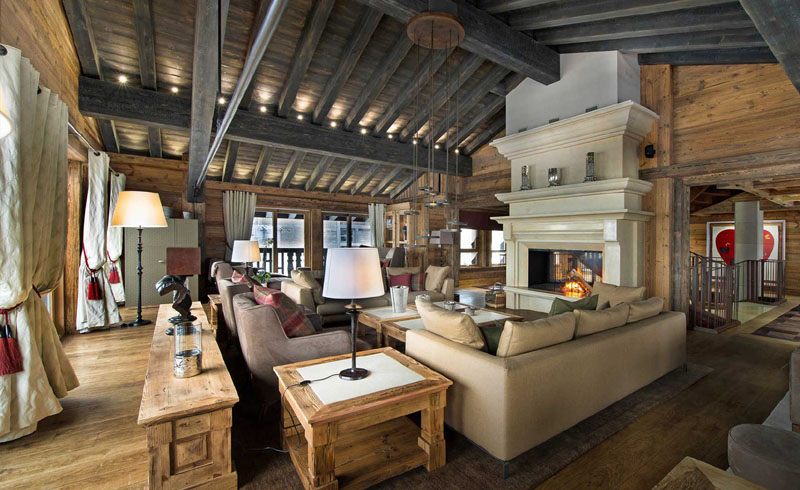
The width and height of the screenshot is (800, 490). Find the location of `pillow`. pillow is located at coordinates (550, 331).